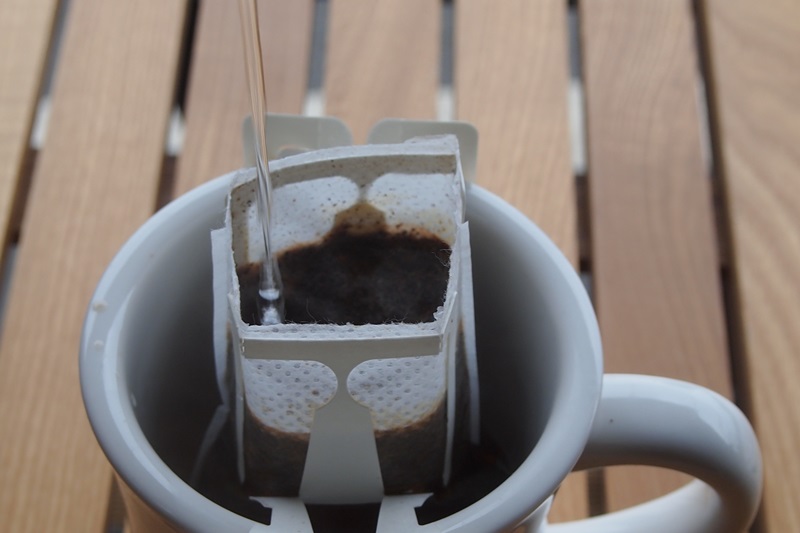
The height and width of the screenshot is (533, 800). Find the location of `clear utensil`. clear utensil is located at coordinates (249, 24), (249, 99), (265, 154), (266, 238).